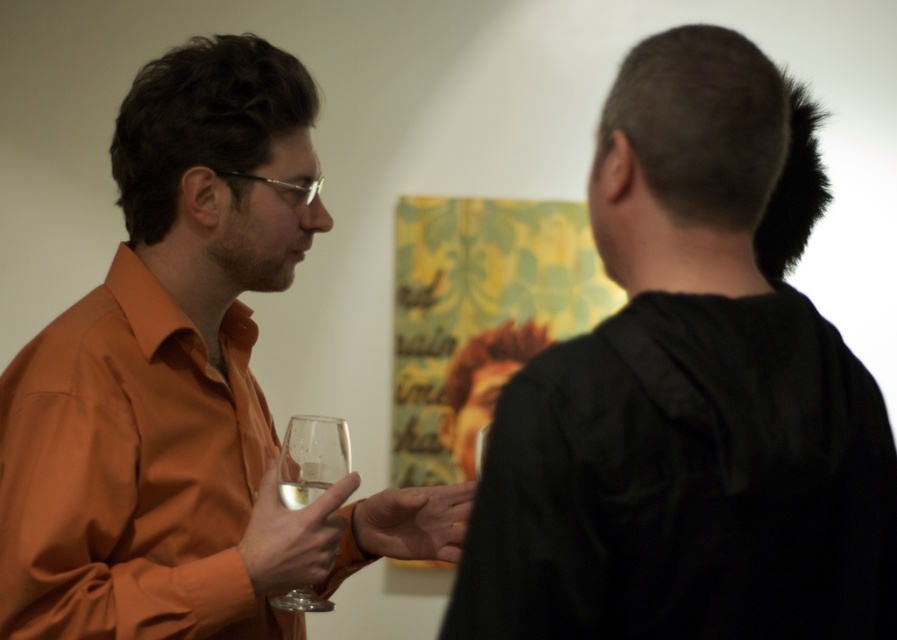
Question: Does orange matte shirt at left appear over clear glass wine at center?

Choices:
 (A) yes
 (B) no

Answer: (A)

Question: Among these objects, which one is farthest from the camera?

Choices:
 (A) clear glass wine glass at center
 (B) clear glass wine at center
 (C) orange matte shirt at left
 (D) black matte shirt at upper right

Answer: (B)

Question: Does black matte shirt at upper right have a lesser width compared to orange matte shirt at left?

Choices:
 (A) no
 (B) yes

Answer: (B)

Question: Is orange matte shirt at left to the right of clear glass wine at center from the viewer's perspective?

Choices:
 (A) no
 (B) yes

Answer: (A)

Question: Considering the real-world distances, which object is farthest from the clear glass wine glass at center?

Choices:
 (A) clear glass wine at center
 (B) orange matte shirt at left
 (C) black matte shirt at upper right

Answer: (C)

Question: Which point is farther to the camera?

Choices:
 (A) black matte shirt at upper right
 (B) orange matte shirt at left
 (C) clear glass wine at center

Answer: (C)